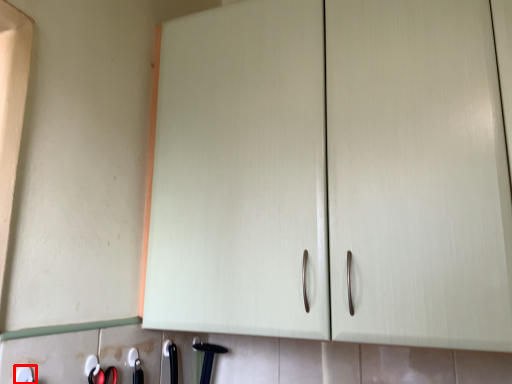
Question: From the image's perspective, where is tool (annotated by the red box) located in relation to door handle in the image?

Choices:
 (A) below
 (B) above

Answer: (B)